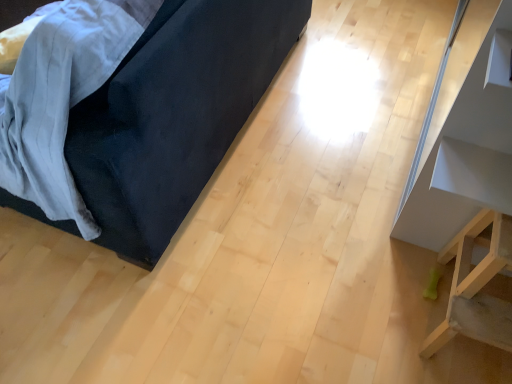
Question: From a real-world perspective, is velvet dark blue couch at left, the first furniture when ordered from left to right, located higher than white glossy shelf at upper right, positioned as the 1th furniture in right-to-left order?

Choices:
 (A) yes
 (B) no

Answer: (B)

Question: Considering the relative positions of velvet dark blue couch at left, the first furniture when ordered from left to right, and white glossy shelf at upper right, marked as the 3th furniture in a left-to-right arrangement, in the image provided, is velvet dark blue couch at left, the first furniture when ordered from left to right, to the left of white glossy shelf at upper right, marked as the 3th furniture in a left-to-right arrangement, from the viewer's perspective?

Choices:
 (A) no
 (B) yes

Answer: (B)

Question: Is velvet dark blue couch at left, the first furniture when ordered from left to right, positioned far away from white glossy shelf at upper right, positioned as the 1th furniture in right-to-left order?

Choices:
 (A) yes
 (B) no

Answer: (B)

Question: Is velvet dark blue couch at left, the first furniture when ordered from left to right, smaller than white glossy shelf at upper right, marked as the 3th furniture in a left-to-right arrangement?

Choices:
 (A) no
 (B) yes

Answer: (A)

Question: From the image's perspective, is velvet dark blue couch at left, the first furniture when ordered from left to right, located beneath white glossy shelf at upper right, marked as the 3th furniture in a left-to-right arrangement?

Choices:
 (A) yes
 (B) no

Answer: (B)

Question: Is the position of velvet dark blue couch at left, placed as the 3th furniture when sorted from right to left, more distant than that of white glossy shelf at upper right, marked as the 3th furniture in a left-to-right arrangement?

Choices:
 (A) yes
 (B) no

Answer: (B)

Question: Is white glossy shelf at upper right, positioned as the 1th furniture in right-to-left order, outside of velvet dark blue couch at left, the first furniture when ordered from left to right?

Choices:
 (A) yes
 (B) no

Answer: (A)

Question: From the image's perspective, is white glossy shelf at upper right, marked as the 3th furniture in a left-to-right arrangement, above velvet dark blue couch at left, the first furniture when ordered from left to right?

Choices:
 (A) yes
 (B) no

Answer: (B)

Question: Can you confirm if white glossy shelf at upper right, marked as the 3th furniture in a left-to-right arrangement, is positioned to the right of velvet dark blue couch at left, the first furniture when ordered from left to right?

Choices:
 (A) no
 (B) yes

Answer: (B)

Question: Can you confirm if white glossy shelf at upper right, positioned as the 1th furniture in right-to-left order, is smaller than velvet dark blue couch at left, placed as the 3th furniture when sorted from right to left?

Choices:
 (A) no
 (B) yes

Answer: (B)

Question: Is white glossy shelf at upper right, positioned as the 1th furniture in right-to-left order, oriented towards velvet dark blue couch at left, placed as the 3th furniture when sorted from right to left?

Choices:
 (A) yes
 (B) no

Answer: (A)

Question: From a real-world perspective, is white glossy shelf at upper right, marked as the 3th furniture in a left-to-right arrangement, physically above velvet dark blue couch at left, placed as the 3th furniture when sorted from right to left?

Choices:
 (A) no
 (B) yes

Answer: (B)

Question: Is light wood stool at lower right, the second furniture from the left, a part of white glossy shelf at upper right, marked as the 3th furniture in a left-to-right arrangement?

Choices:
 (A) no
 (B) yes

Answer: (A)